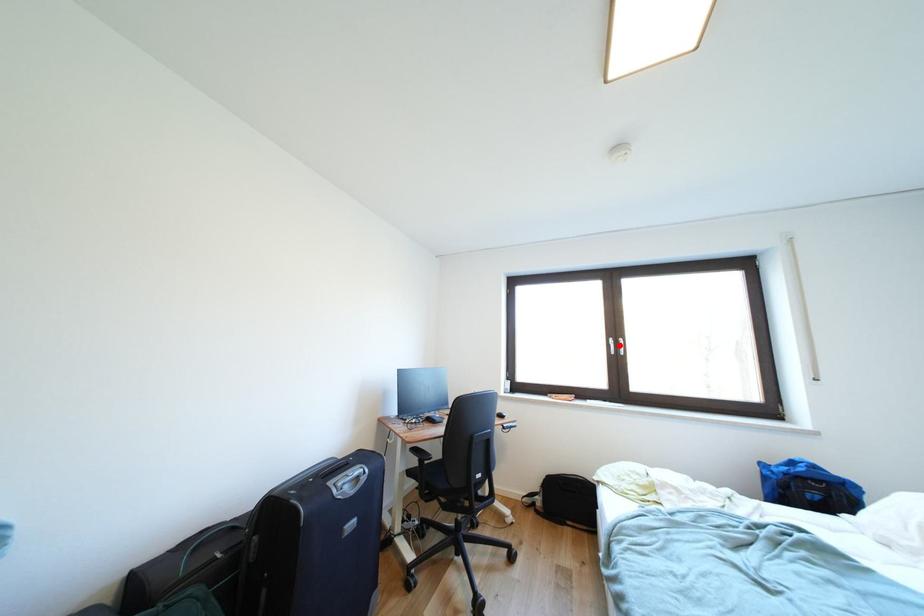
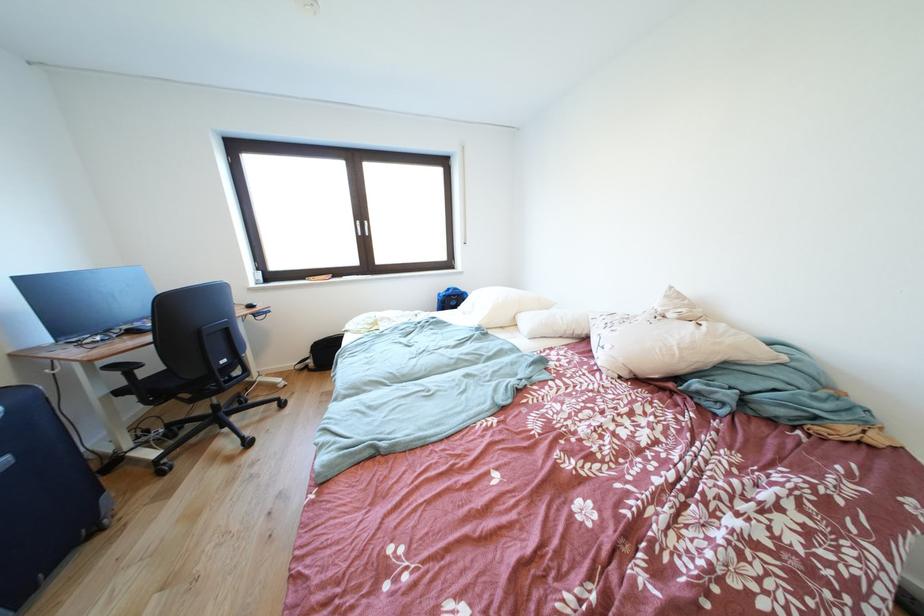
In the second image, find the point that corresponds to the highlighted location in the first image.

(367, 228)